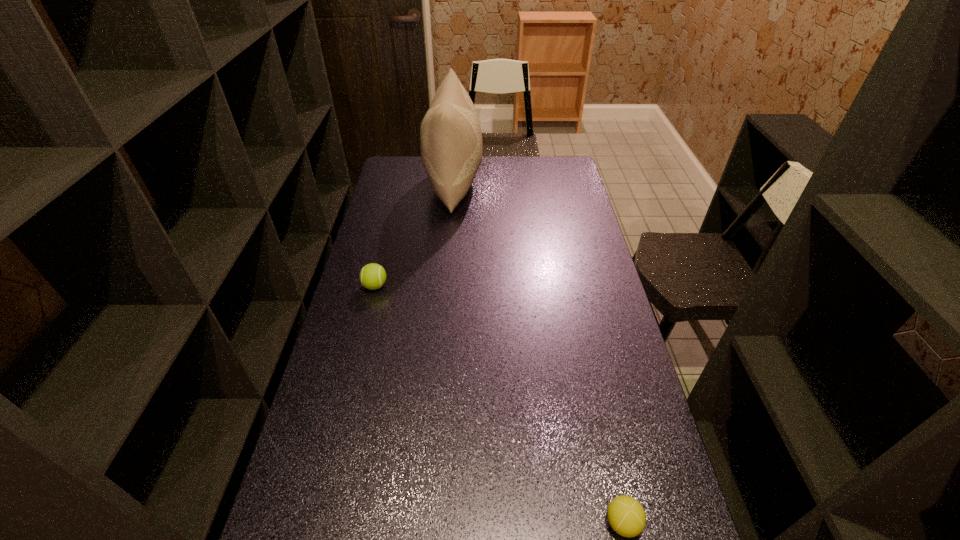
Locate an element on the screen. The image size is (960, 540). free space at the right edge is located at coordinates (583, 216).

Locate an element on the screen. vacant area that lies between the farthest object and the second nearest object is located at coordinates (415, 235).

Find the location of a particular element. Image resolution: width=960 pixels, height=540 pixels. empty location between the leftmost object and the second object from left to right is located at coordinates (415, 235).

The height and width of the screenshot is (540, 960). Identify the location of vacant area that lies between the left tennis ball and the farthest object. (415, 235).

Find the location of a particular element. free space between the leftmost object and the farthest object is located at coordinates (415, 235).

The image size is (960, 540). What are the coordinates of `object that is the closest to the second object from left to right` in the screenshot? It's located at (372, 276).

Where is `object identified as the second closest to the right tennis ball`? object identified as the second closest to the right tennis ball is located at coordinates (450, 135).

Find the location of a particular element. This screenshot has width=960, height=540. free location that satisfies the following two spatial constraints: 1. on the front side of the cushion; 2. on the front side of the farther tennis ball is located at coordinates (445, 286).